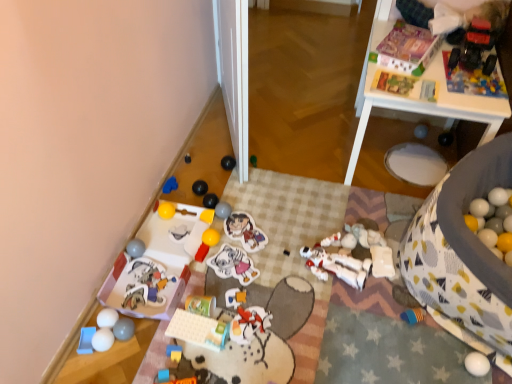
Where is `free space behind matte plastic toy at lower left, which appears as the 22th toy when viewed from the right`? The height and width of the screenshot is (384, 512). free space behind matte plastic toy at lower left, which appears as the 22th toy when viewed from the right is located at coordinates (167, 242).